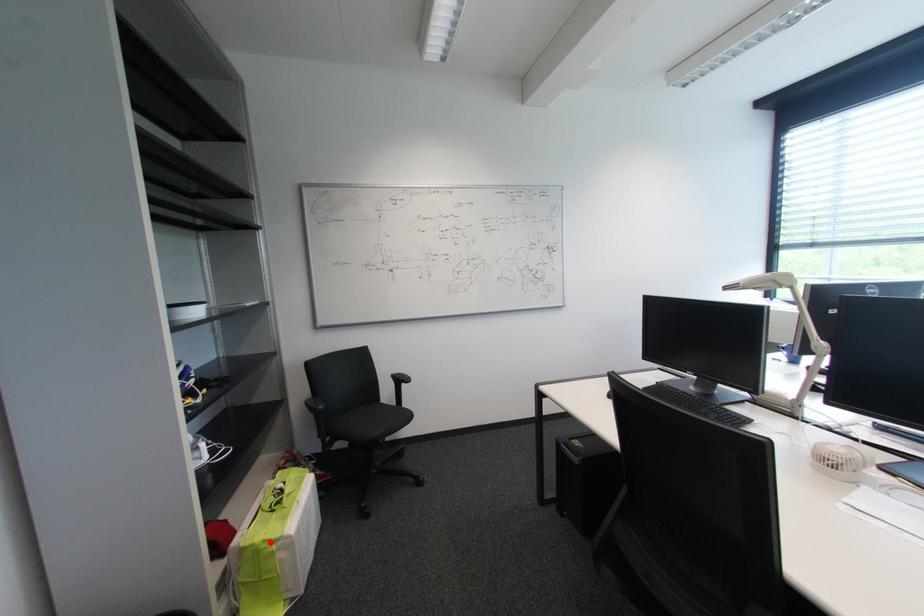
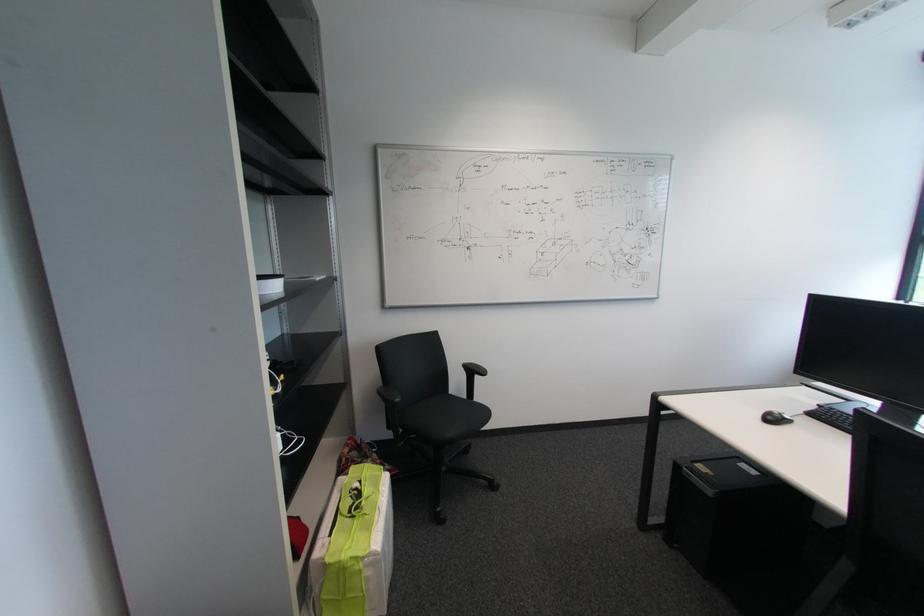
The point at the highlighted location is marked in the first image. Where is the corresponding point in the second image?

(358, 560)